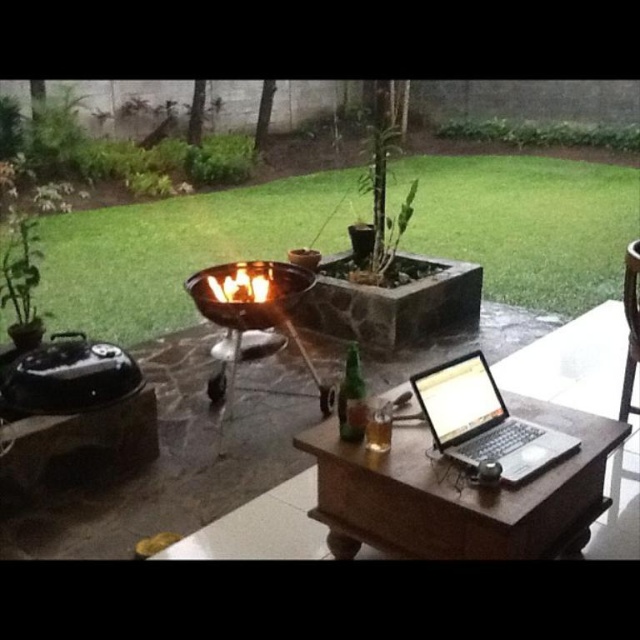
Can you confirm if wooden table at center is positioned to the right of silver metallic laptop at center?

Incorrect, wooden table at center is not on the right side of silver metallic laptop at center.

Does wooden table at center have a lesser width compared to silver metallic laptop at center?

In fact, wooden table at center might be wider than silver metallic laptop at center.

This screenshot has width=640, height=640. I want to click on wooden table at center, so click(x=460, y=493).

Where is `wooden table at center`? Image resolution: width=640 pixels, height=640 pixels. wooden table at center is located at coordinates (460, 493).

Does silver metallic laptop at center appear on the left side of flamematerial/texture at center?

Incorrect, silver metallic laptop at center is not on the left side of flamematerial/texture at center.

Who is taller, silver metallic laptop at center or flamematerial/texture at center?

silver metallic laptop at center is taller.

Between point (497, 435) and point (269, 291), which one is positioned in front?

Point (497, 435)

At what (x,y) coordinates should I click in order to perform the action: click on silver metallic laptop at center. Please return your answer as a coordinate pair (x, y). Looking at the image, I should click on (484, 420).

Can you confirm if brown wooden chair at right is smaller than flamematerial/texture at center?

Actually, brown wooden chair at right might be larger than flamematerial/texture at center.

Does point (624, 292) come farther from viewer compared to point (240, 269)?

No, it is not.

This screenshot has height=640, width=640. I want to click on brown wooden chair at right, so click(630, 326).